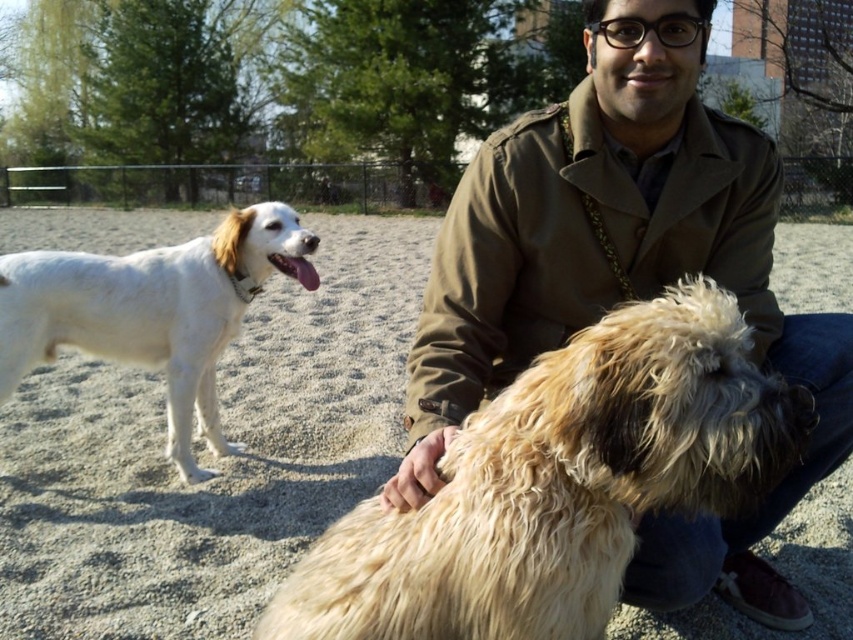
You are a photographer standing at the center of the park. You want to take a photo of the brown textured coat at center. Where should you aim your camera to capture it?

You should aim your camera at point 0.436 on the horizontal axis and 0.732 on the vertical axis to capture the brown textured coat at center.

You are a photographer taking a picture of the scene. You notice the brown textured coat at center and the fluffy beige dog at center. Which object is positioned higher in the image?

The brown textured coat at center is positioned higher than the fluffy beige dog at center in the image.